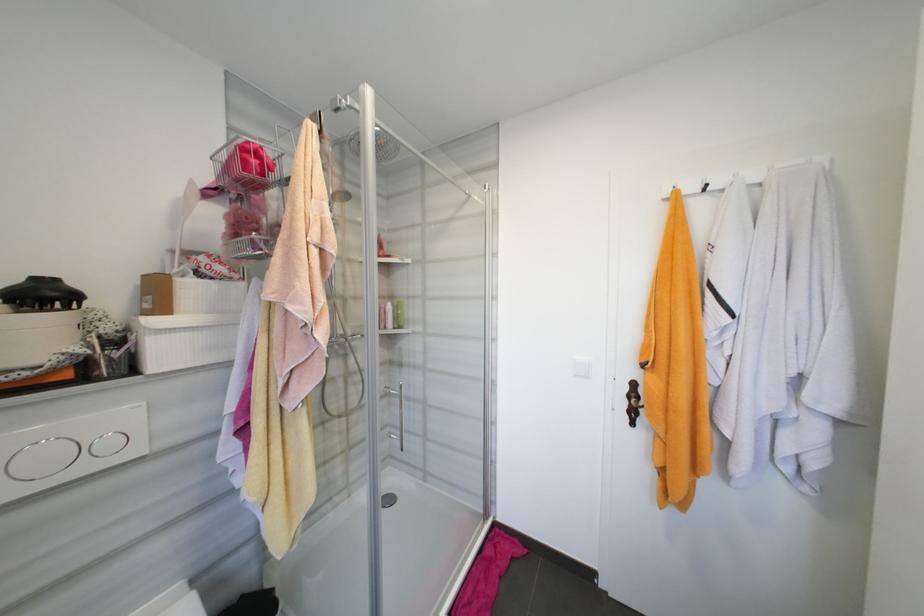
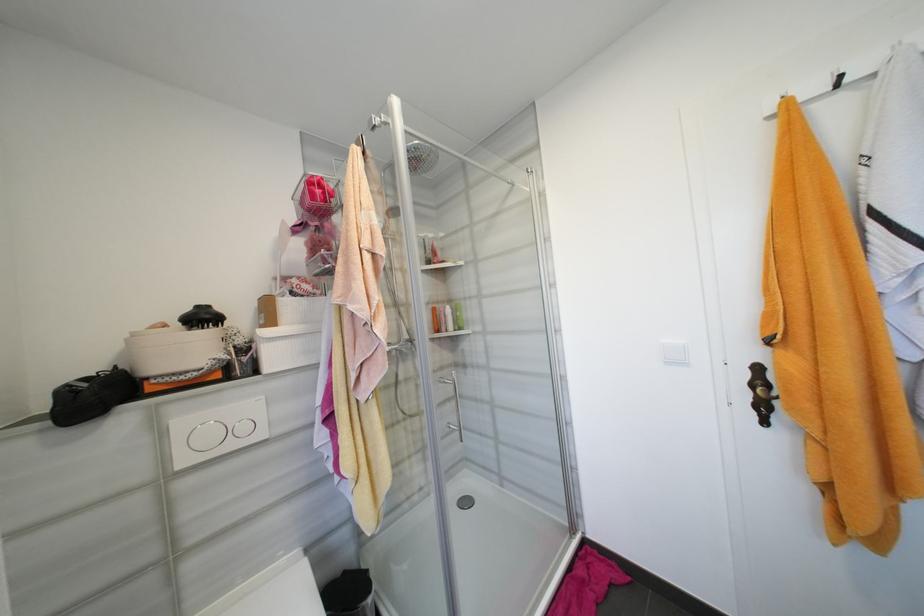
Where in the second image is the point corresponding to (115,445) from the first image?

(249, 429)